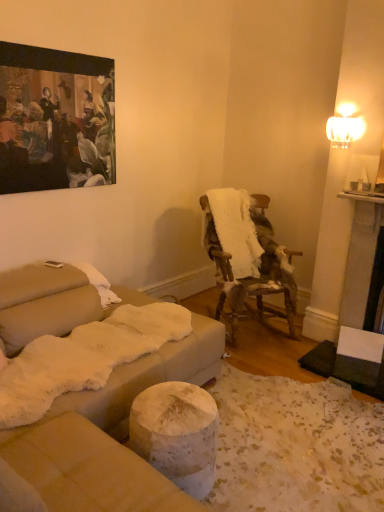
Question: Is oil painting at upper left at the right side of white fluffy blanket at center-right?

Choices:
 (A) no
 (B) yes

Answer: (A)

Question: From the image's perspective, would you say oil painting at upper left is shown under white fluffy blanket at center-right?

Choices:
 (A) yes
 (B) no

Answer: (B)

Question: Is oil painting at upper left wider than white fluffy blanket at center-right?

Choices:
 (A) no
 (B) yes

Answer: (A)

Question: From a real-world perspective, is oil painting at upper left below white fluffy blanket at center-right?

Choices:
 (A) no
 (B) yes

Answer: (A)

Question: From the image's perspective, is oil painting at upper left over white fluffy blanket at center-right?

Choices:
 (A) no
 (B) yes

Answer: (B)

Question: Is oil painting at upper left taller than white fluffy blanket at center-right?

Choices:
 (A) no
 (B) yes

Answer: (B)

Question: Is there a large distance between fur-covered wooden chair at center-right and oil painting at upper left?

Choices:
 (A) yes
 (B) no

Answer: (A)

Question: Is fur-covered wooden chair at center-right facing away from oil painting at upper left?

Choices:
 (A) yes
 (B) no

Answer: (B)

Question: Does fur-covered wooden chair at center-right appear on the right side of oil painting at upper left?

Choices:
 (A) no
 (B) yes

Answer: (B)

Question: Does fur-covered wooden chair at center-right have a smaller size compared to oil painting at upper left?

Choices:
 (A) yes
 (B) no

Answer: (B)

Question: Is fur-covered wooden chair at center-right thinner than oil painting at upper left?

Choices:
 (A) no
 (B) yes

Answer: (A)

Question: Is the depth of fur-covered wooden chair at center-right greater than that of oil painting at upper left?

Choices:
 (A) yes
 (B) no

Answer: (A)

Question: From a real-world perspective, does white fluffy blanket at center-right stand above oil painting at upper left?

Choices:
 (A) yes
 (B) no

Answer: (B)